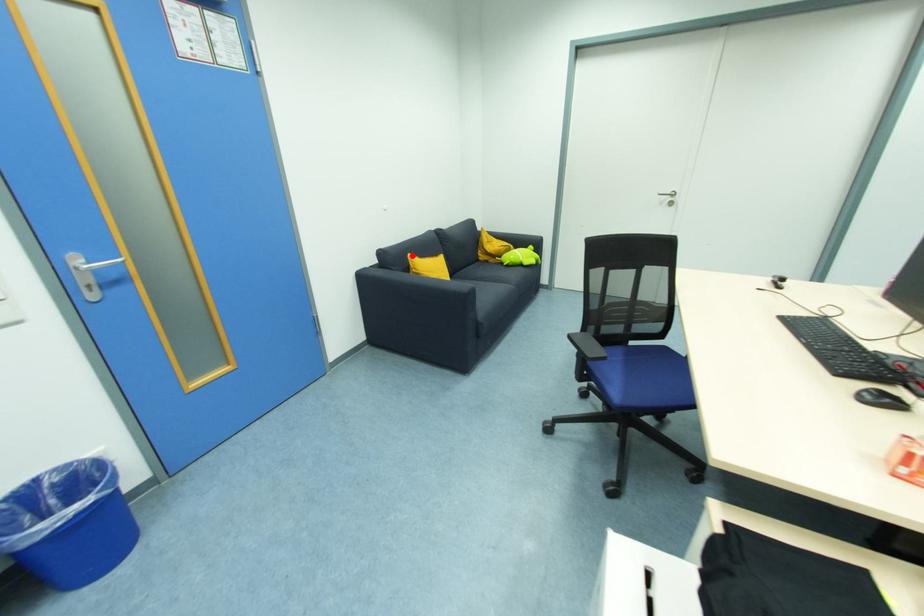
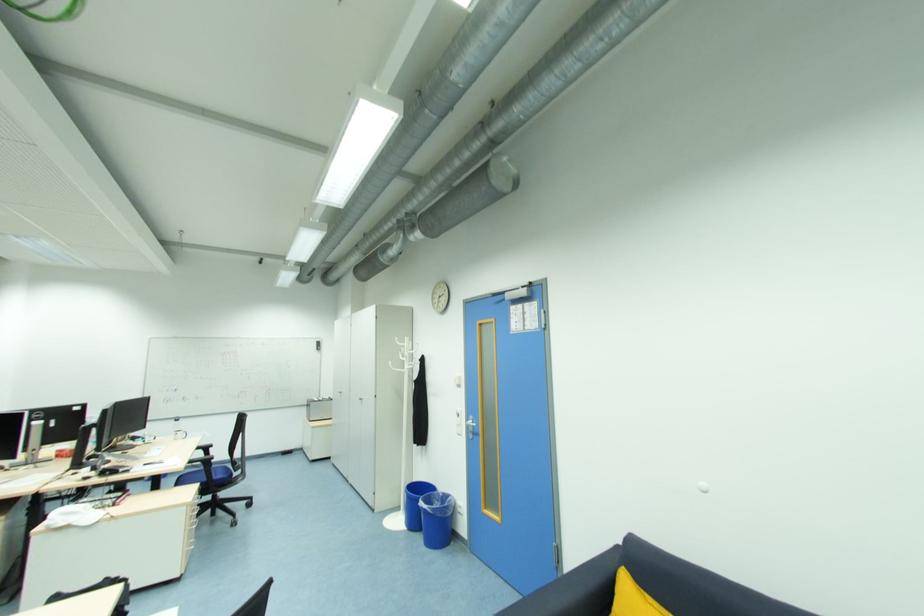
Find the pixel in the second image that matches the highlighted location in the first image.

(627, 569)